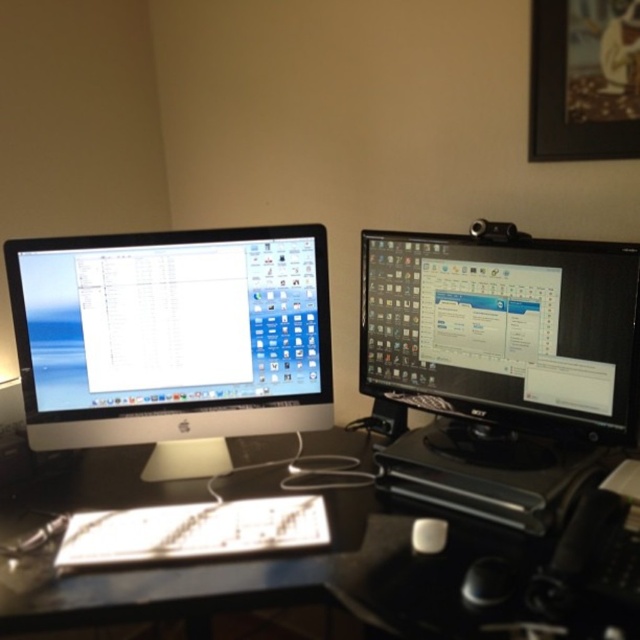
Question: Which of the following is the closest to the observer?

Choices:
 (A) white matte mouse at center
 (B) black glossy table at center
 (C) black glossy monitor at right

Answer: (B)

Question: Is black glossy table at center above satin black monitor at left?

Choices:
 (A) no
 (B) yes

Answer: (A)

Question: Is satin black monitor at left to the left of black glossy monitor at right from the viewer's perspective?

Choices:
 (A) yes
 (B) no

Answer: (A)

Question: Where is black glossy table at center located in relation to black glossy monitor at right in the image?

Choices:
 (A) right
 (B) left

Answer: (B)

Question: Estimate the real-world distances between objects in this image. Which object is closer to the black glossy monitor at right?

Choices:
 (A) black glossy table at center
 (B) satin black monitor at left
 (C) white matte mouse at center

Answer: (A)

Question: Estimate the real-world distances between objects in this image. Which object is farther from the satin black monitor at left?

Choices:
 (A) white matte mouse at center
 (B) black glossy monitor at right
 (C) black glossy table at center

Answer: (A)